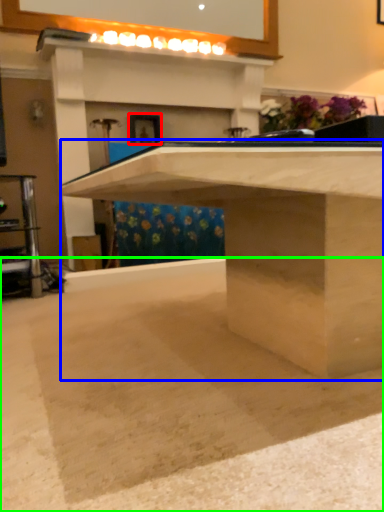
Question: Estimate the real-world distances between objects in this image. Which object is closer to picture frame (highlighted by a red box), table (highlighted by a blue box) or concrete (highlighted by a green box)?

Choices:
 (A) table
 (B) concrete

Answer: (A)